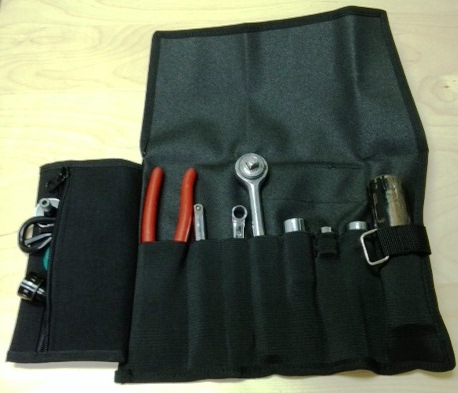
Identify the location of yellow inner corner on the top left. The image size is (458, 393). (14, 14).